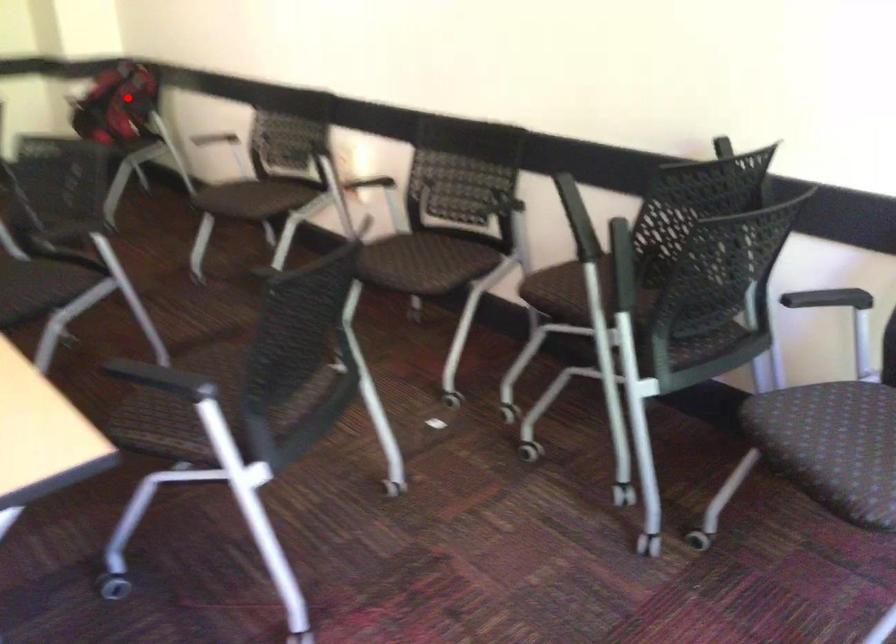
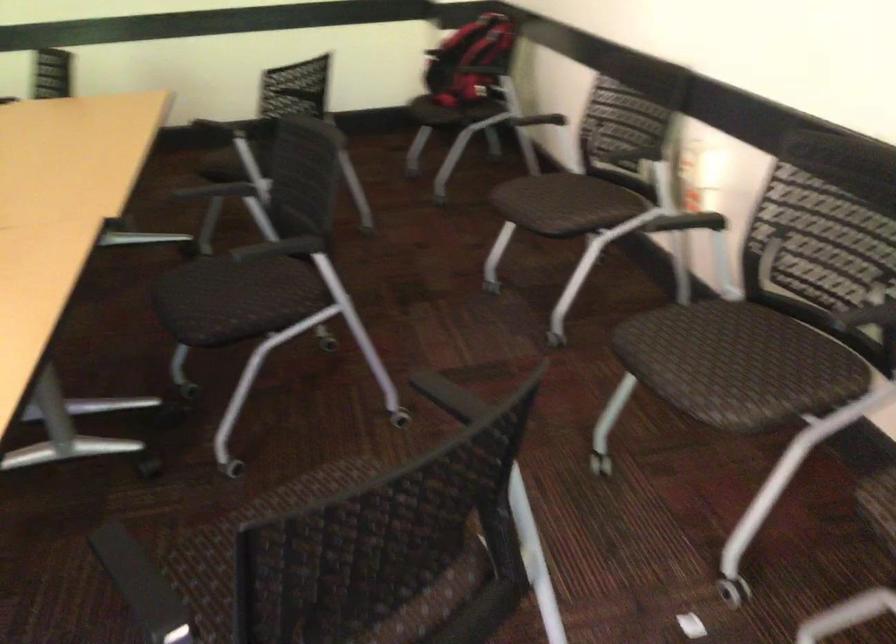
Question: I am providing you with two images of the same scene from different viewpoints. A red point is shown in image1. For the corresponding object point in image2, is it positioned nearer or farther from the camera?

Choices:
 (A) Nearer
 (B) Farther

Answer: (A)